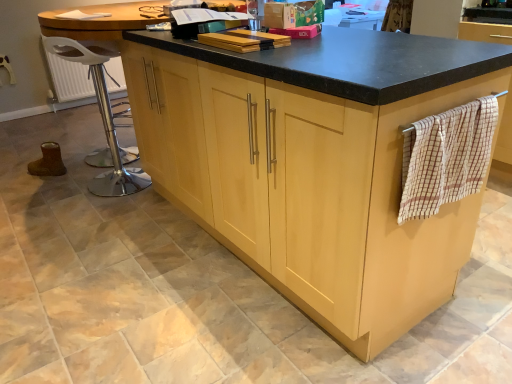
In order to click on vacant space situated on the left part of metallic silver bar stool at left in this screenshot , I will do (x=60, y=187).